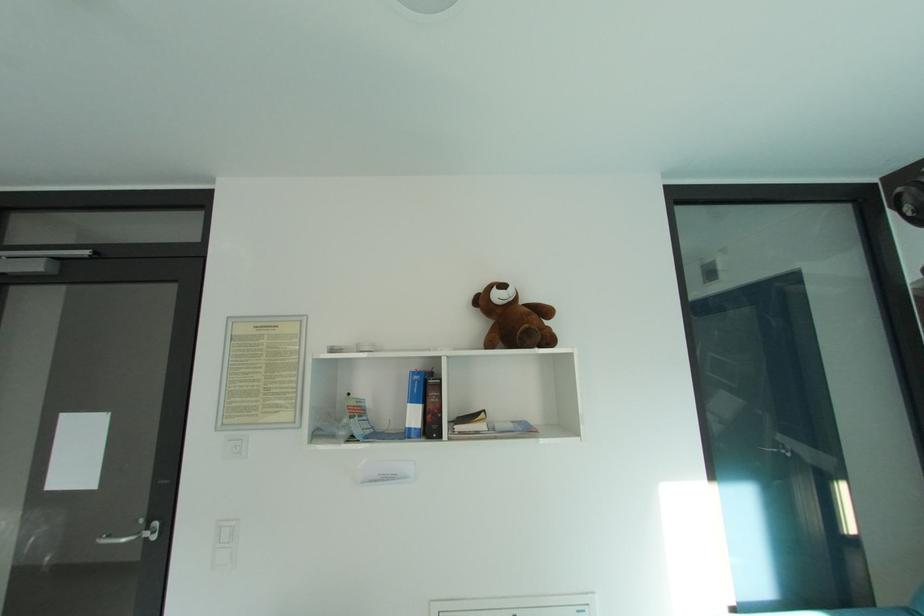
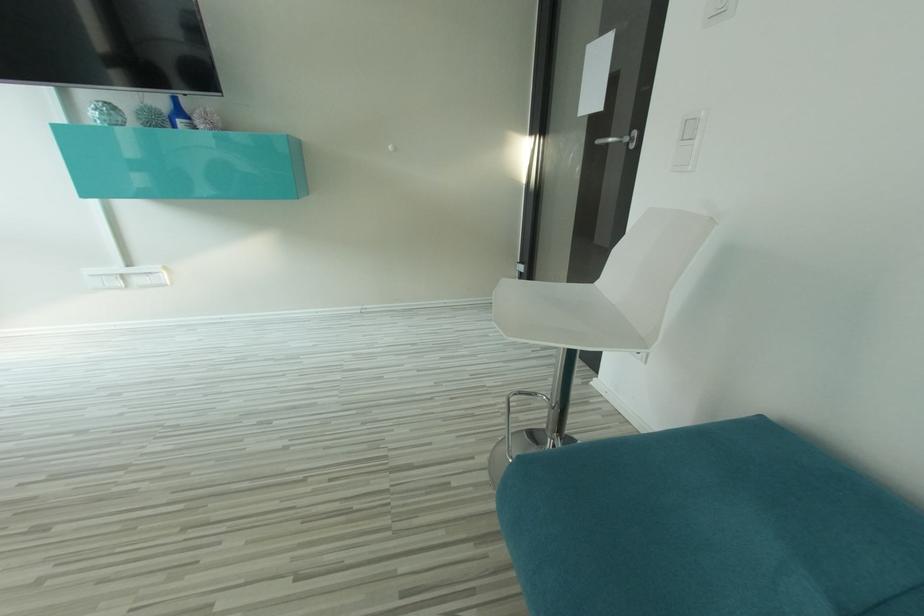
The first image is from the beginning of the video and the second image is from the end. How did the camera likely rotate when shooting the video?

The camera rotated toward left-down.